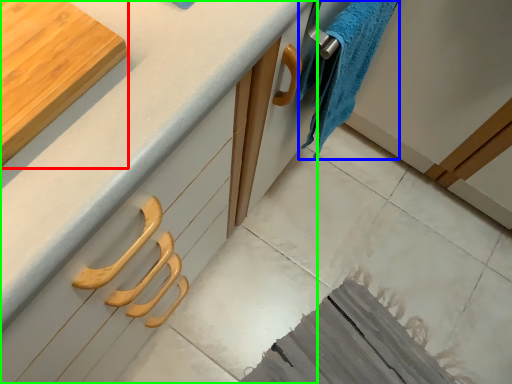
Question: Considering the real-world distances, which object is farthest from cutting board (highlighted by a red box)? bath towel (highlighted by a blue box) or countertop (highlighted by a green box)?

Choices:
 (A) bath towel
 (B) countertop

Answer: (A)